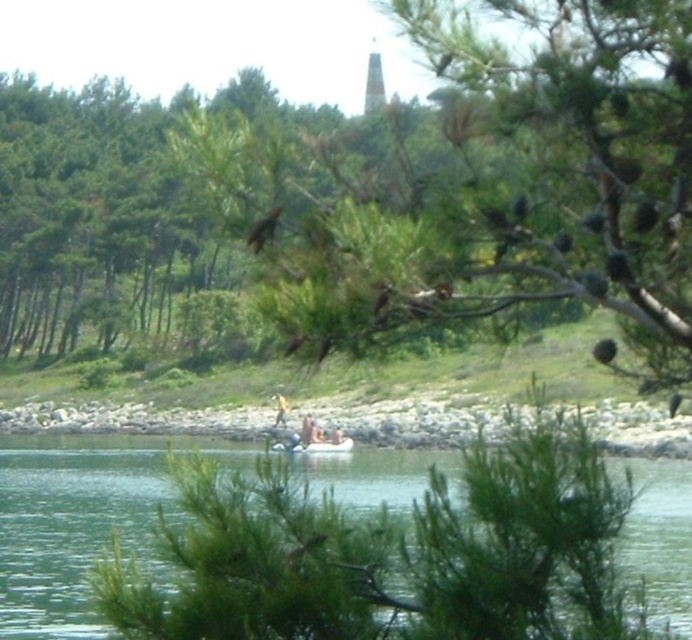
Question: Does green water at center appear under gray rocky shoreline at lower center?

Choices:
 (A) no
 (B) yes

Answer: (B)

Question: Where is green water at center located in relation to gray rocky shoreline at lower center in the image?

Choices:
 (A) right
 (B) left

Answer: (B)

Question: Which of the following is the farthest from the observer?

Choices:
 (A) (255, 410)
 (B) (309, 472)

Answer: (A)

Question: Which of the following is the farthest from the observer?

Choices:
 (A) gray rocky shoreline at lower center
 (B) green water at center

Answer: (A)

Question: Is green water at center closer to the viewer compared to gray rocky shoreline at lower center?

Choices:
 (A) no
 (B) yes

Answer: (B)

Question: Which object is closer to the camera taking this photo?

Choices:
 (A) gray rocky shoreline at lower center
 (B) green water at center

Answer: (B)